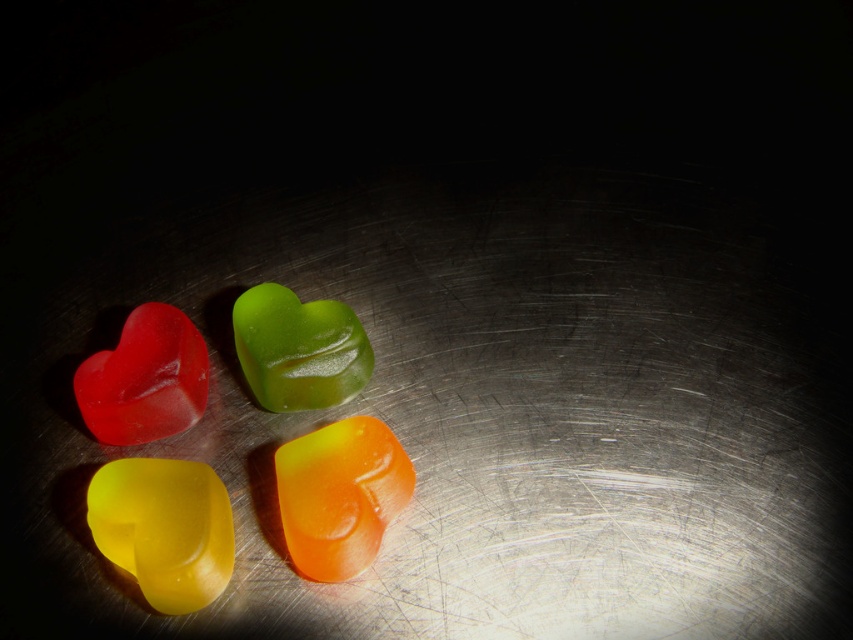
Based on the photo, is translucent orange heart at center to the right of green translucent heart at center from the viewer's perspective?

Indeed, translucent orange heart at center is positioned on the right side of green translucent heart at center.

Between translucent orange heart at center and green translucent heart at center, which one is positioned higher?

Positioned higher is green translucent heart at center.

Which is behind, point (328, 568) or point (285, 397)?

Positioned behind is point (285, 397).

The width and height of the screenshot is (853, 640). In order to click on translucent orange heart at center in this screenshot , I will do `click(340, 496)`.

Who is positioned more to the left, matte translucent heart at upper left or green translucent heart at center?

From the viewer's perspective, matte translucent heart at upper left appears more on the left side.

Is matte translucent heart at upper left bigger than green translucent heart at center?

Correct, matte translucent heart at upper left is larger in size than green translucent heart at center.

Is point (120, 412) farther from camera compared to point (259, 401)?

That is False.

Image resolution: width=853 pixels, height=640 pixels. Identify the location of matte translucent heart at upper left. (x=144, y=378).

Is translucent orange heart at center to the left of matte translucent heart at upper left from the viewer's perspective?

In fact, translucent orange heart at center is to the right of matte translucent heart at upper left.

Is point (387, 448) positioned before point (90, 401)?

No, (387, 448) is behind (90, 401).

Image resolution: width=853 pixels, height=640 pixels. Find the location of `translucent orange heart at center`. translucent orange heart at center is located at coordinates (340, 496).